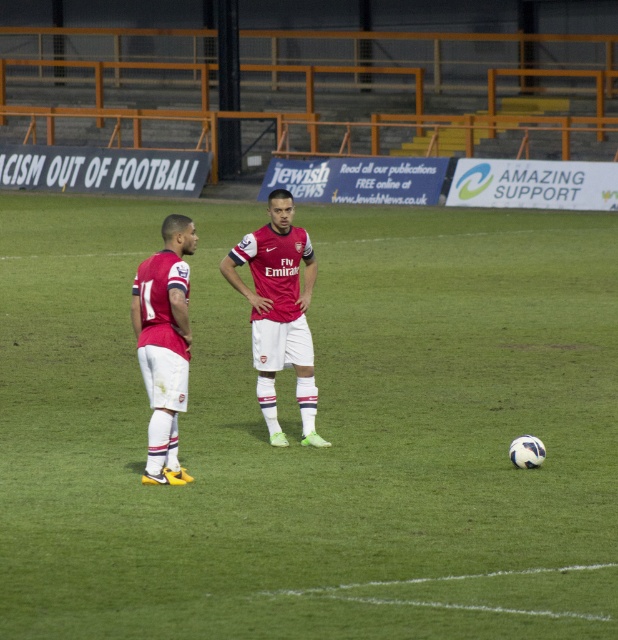
Question: Based on their relative distances, which object is nearer to the white smooth soccer ball at center?

Choices:
 (A) matte red jersey at left
 (B) matte red jersey at center

Answer: (B)

Question: From the image, what is the correct spatial relationship of white smooth soccer ball at center in relation to matte red jersey at center?

Choices:
 (A) above
 (B) below

Answer: (A)

Question: Which of these objects is positioned closest to the white smooth soccer ball at center?

Choices:
 (A) matte red jersey at center
 (B) matte red jersey at left

Answer: (A)

Question: Is white smooth soccer ball at center behind matte red jersey at left?

Choices:
 (A) no
 (B) yes

Answer: (A)

Question: Which of these objects is positioned farthest from the matte red jersey at center?

Choices:
 (A) matte red jersey at left
 (B) white smooth soccer ball at center

Answer: (B)

Question: Does matte red jersey at center have a greater width compared to matte red jersey at left?

Choices:
 (A) yes
 (B) no

Answer: (A)